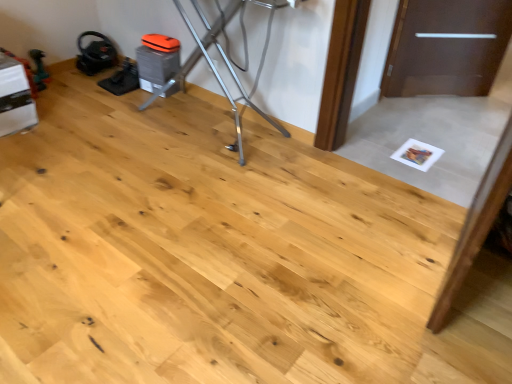
Question: From the image's perspective, is metallic silver ironing board at upper center positioned above or below brown matte door at upper right?

Choices:
 (A) below
 (B) above

Answer: (A)

Question: From a real-world perspective, is metallic silver ironing board at upper center physically located above or below brown matte door at upper right?

Choices:
 (A) above
 (B) below

Answer: (A)

Question: In the image, is metallic silver ironing board at upper center on the left side or the right side of brown matte door at upper right?

Choices:
 (A) right
 (B) left

Answer: (B)

Question: Is brown matte door at upper right in front of or behind metallic silver ironing board at upper center in the image?

Choices:
 (A) front
 (B) behind

Answer: (B)

Question: Based on their sizes in the image, would you say brown matte door at upper right is bigger or smaller than metallic silver ironing board at upper center?

Choices:
 (A) big
 (B) small

Answer: (B)

Question: From a real-world perspective, is brown matte door at upper right physically located above or below metallic silver ironing board at upper center?

Choices:
 (A) below
 (B) above

Answer: (A)

Question: Looking at their shapes, would you say brown matte door at upper right is wider or thinner than metallic silver ironing board at upper center?

Choices:
 (A) wide
 (B) thin

Answer: (B)